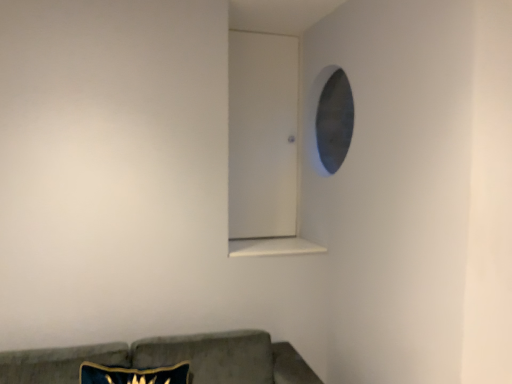
Question: Considering their positions, is white smooth window sill at center located in front of or behind velvet green couch at lower left?

Choices:
 (A) behind
 (B) front

Answer: (A)

Question: Considering the positions of white smooth window sill at center and velvet green couch at lower left in the image, is white smooth window sill at center wider or thinner than velvet green couch at lower left?

Choices:
 (A) wide
 (B) thin

Answer: (B)

Question: Considering the positions of white smooth window sill at center and velvet green couch at lower left in the image, is white smooth window sill at center taller or shorter than velvet green couch at lower left?

Choices:
 (A) short
 (B) tall

Answer: (A)

Question: In terms of width, does velvet green couch at lower left look wider or thinner when compared to white smooth window sill at center?

Choices:
 (A) wide
 (B) thin

Answer: (A)

Question: Based on their positions, is velvet green couch at lower left located to the left or right of white smooth window sill at center?

Choices:
 (A) right
 (B) left

Answer: (B)

Question: From a real-world perspective, is velvet green couch at lower left positioned above or below white smooth window sill at center?

Choices:
 (A) above
 (B) below

Answer: (B)

Question: From the image's perspective, relative to white smooth window sill at center, is velvet green couch at lower left above or below?

Choices:
 (A) below
 (B) above

Answer: (A)